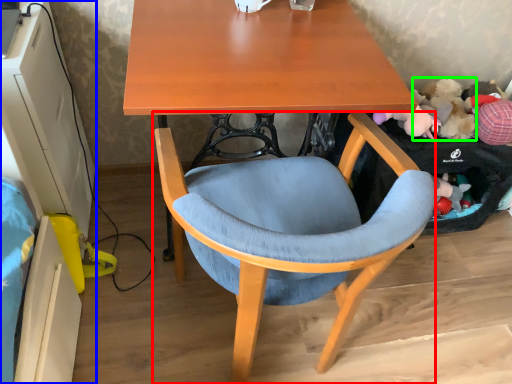
Question: Based on their relative distances, which object is nearer to chair (highlighted by a red box)? Choose from computer desk (highlighted by a blue box) and toy (highlighted by a green box).

Choices:
 (A) computer desk
 (B) toy

Answer: (A)